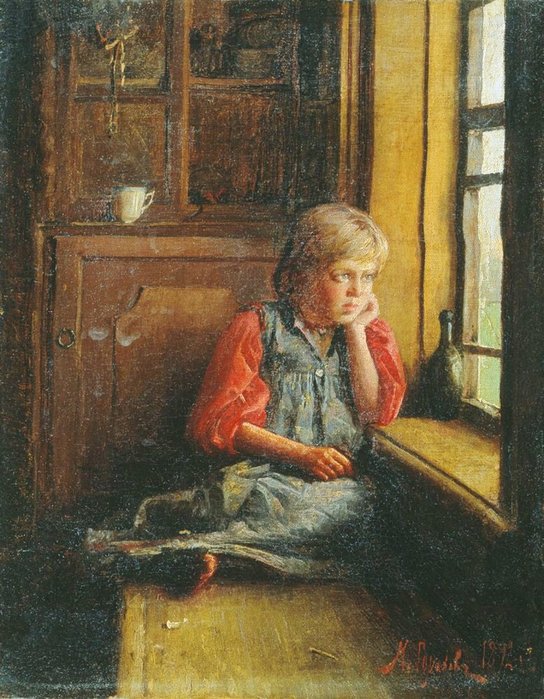
Where is `metal handle`? The width and height of the screenshot is (544, 699). metal handle is located at coordinates pos(70,330).